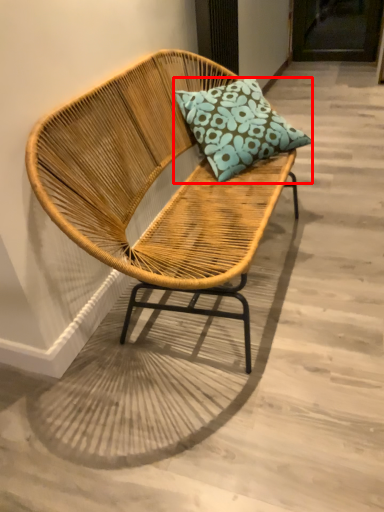
Question: Considering the relative positions of pillow (annotated by the red box) and chair in the image provided, where is pillow (annotated by the red box) located with respect to the staircase?

Choices:
 (A) right
 (B) left

Answer: (A)